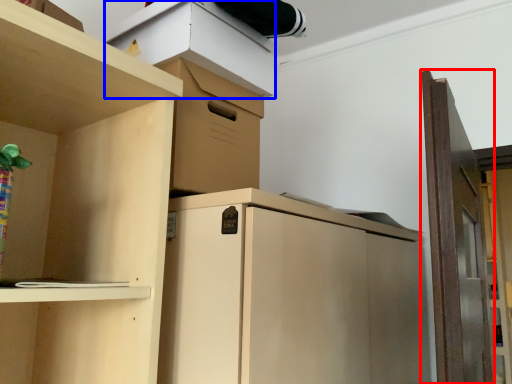
Question: Among these objects, which one is farthest to the camera, door (highlighted by a red box) or cabinet (highlighted by a blue box)?

Choices:
 (A) door
 (B) cabinet

Answer: (B)